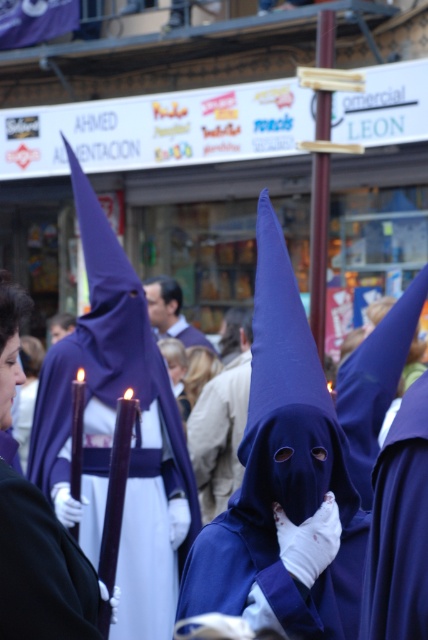
Question: Does matte white gloves at center lie behind smooth beige coat at center?

Choices:
 (A) yes
 (B) no

Answer: (B)

Question: Which object appears closest to the camera in this image?

Choices:
 (A) smooth beige coat at center
 (B) matte white gloves at center
 (C) purple matte hood at center
 (D) purple matte cloth at center

Answer: (B)

Question: Can you confirm if purple matte hood at center is thinner than purple matte cloth at center?

Choices:
 (A) yes
 (B) no

Answer: (A)

Question: Does purple matte hood at center have a greater width compared to matte white gloves at center?

Choices:
 (A) no
 (B) yes

Answer: (B)

Question: Which object appears farthest from the camera in this image?

Choices:
 (A) smooth beige coat at center
 (B) purple matte hood at center
 (C) purple matte cloth at center
 (D) matte white gloves at center

Answer: (A)

Question: Which point is farther to the camera?

Choices:
 (A) purple matte cloth at center
 (B) purple matte hood at center
 (C) smooth beige coat at center
 (D) matte white gloves at center

Answer: (C)